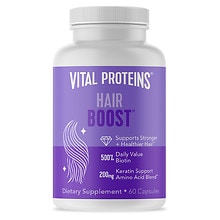
Where is `shadow under the bottle`? shadow under the bottle is located at coordinates (56, 209), (161, 209).